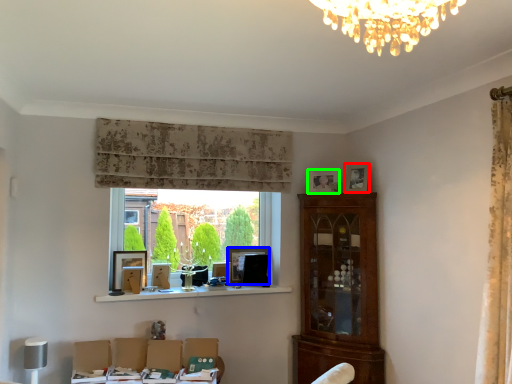
Question: Estimate the real-world distances between objects in this image. Which object is farther from picture frame (highlighted by a red box), picture frame (highlighted by a blue box) or picture frame (highlighted by a green box)?

Choices:
 (A) picture frame
 (B) picture frame

Answer: (A)